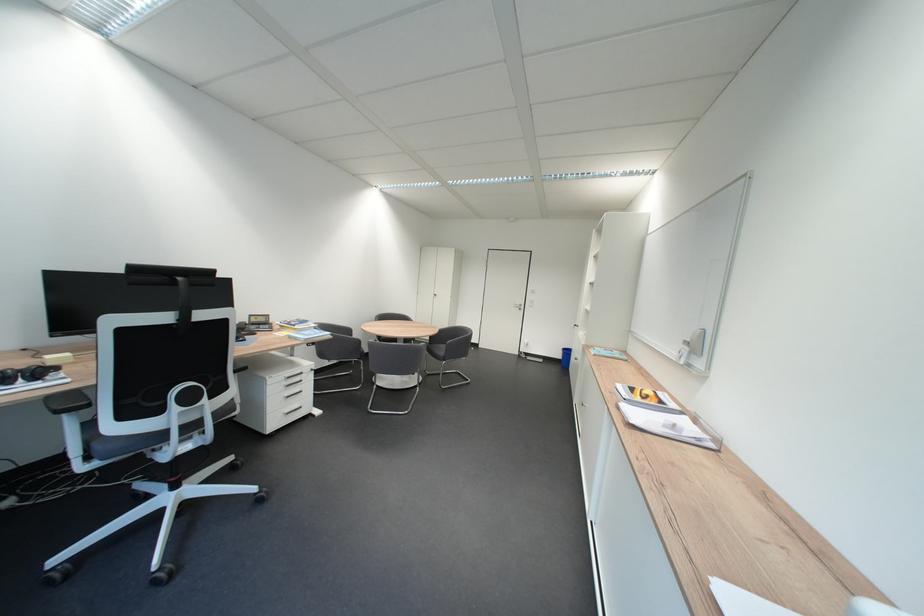
Describe the element at coordinates (73, 400) in the screenshot. Image resolution: width=924 pixels, height=616 pixels. I see `the chair armrest` at that location.